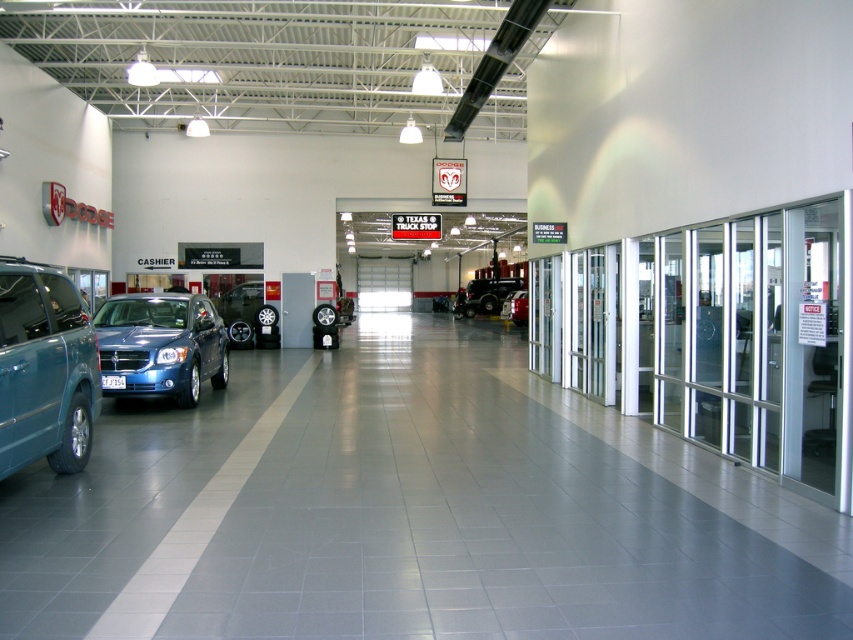
The height and width of the screenshot is (640, 853). What do you see at coordinates (160, 346) in the screenshot?
I see `matte blue suv at center-left` at bounding box center [160, 346].

Can you confirm if matte blue suv at center-left is positioned to the right of matte blue sedan at center?

Yes, matte blue suv at center-left is to the right of matte blue sedan at center.

In the scene shown: Who is more distant from viewer, (199, 323) or (256, 294)?

Answer: Positioned behind is point (256, 294).

Locate an element on the screen. matte blue suv at center-left is located at coordinates (160, 346).

Which is below, matte black truck at center or metallic silver car at center?

Positioned lower is metallic silver car at center.

Who is more distant from viewer, [514,282] or [509,314]?

Point [514,282]

Who is more distant from viewer, (505, 292) or (523, 317)?

A: Positioned behind is point (505, 292).

Where is `matte black truck at center`? matte black truck at center is located at coordinates (486, 294).

Between point (248, 326) and point (506, 316), which one is positioned behind?

The point (506, 316) is behind.

What do you see at coordinates (245, 314) in the screenshot?
I see `matte blue sedan at center` at bounding box center [245, 314].

Which is behind, point (250, 316) or point (514, 321)?

Point (514, 321)

Locate an element on the screen. The image size is (853, 640). matte blue sedan at center is located at coordinates (245, 314).